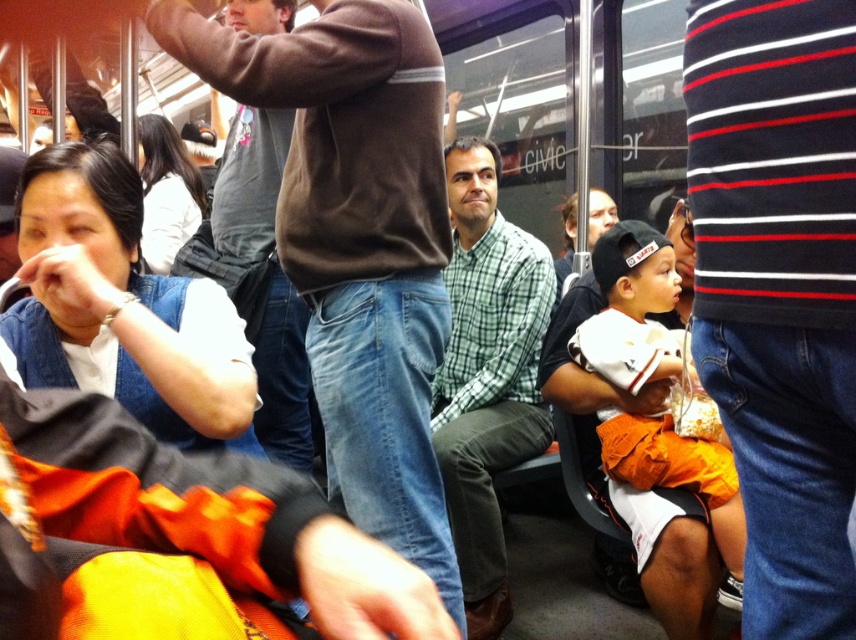
From the picture: You are a passenger on a crowded subway car and you need to reach the black striped sweater at upper right to retrieve your misplaced item. Considering the distance between you and the sweater, can you safely stretch out your arm to reach it without disturbing others?

Result: The distance between you and the black striped sweater at upper right is 76.69 centimeters. Since the average human arm length is about 60 centimeters, you would need to stretch further than your arm length to reach it, so it might not be safe or feasible without disturbing others.

You are a passenger on a crowded public transport vehicle. You see a black striped sweater at upper right and a denim vest at left. Which of these two items is located more to the right side of the vehicle?

The black striped sweater at upper right is positioned on the right side of the denim vest at left, so the black striped sweater at upper right is more to the right side of the vehicle.

You are a passenger on a crowded subway and need to reach the exit door. You see a black striped sweater at upper right and a green checkered shirt at center. Which clothing item is closer to the ceiling?

The black striped sweater at upper right has a lesser height compared to the green checkered shirt at center, so the green checkered shirt at center is closer to the ceiling.